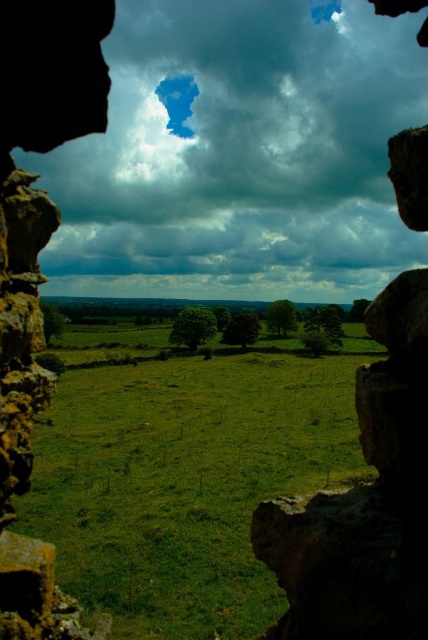
Question: Can you confirm if cloudy sky at center is thinner than green grass at center?

Choices:
 (A) yes
 (B) no

Answer: (B)

Question: Is cloudy sky at center wider than green grass at center?

Choices:
 (A) yes
 (B) no

Answer: (A)

Question: Can you confirm if cloudy sky at center is positioned below green grass at center?

Choices:
 (A) yes
 (B) no

Answer: (B)

Question: Which point is closer to the camera taking this photo?

Choices:
 (A) (306, 458)
 (B) (146, 3)

Answer: (A)